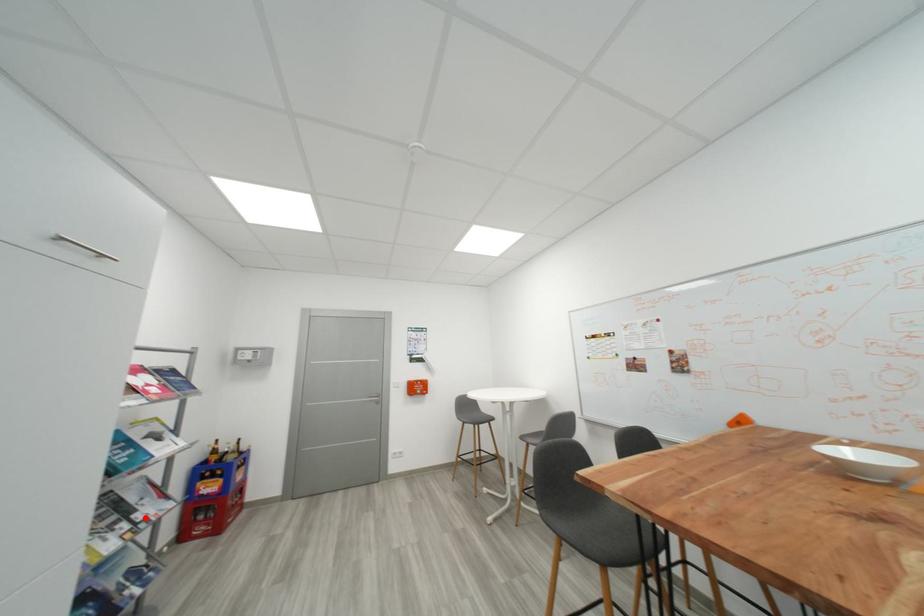
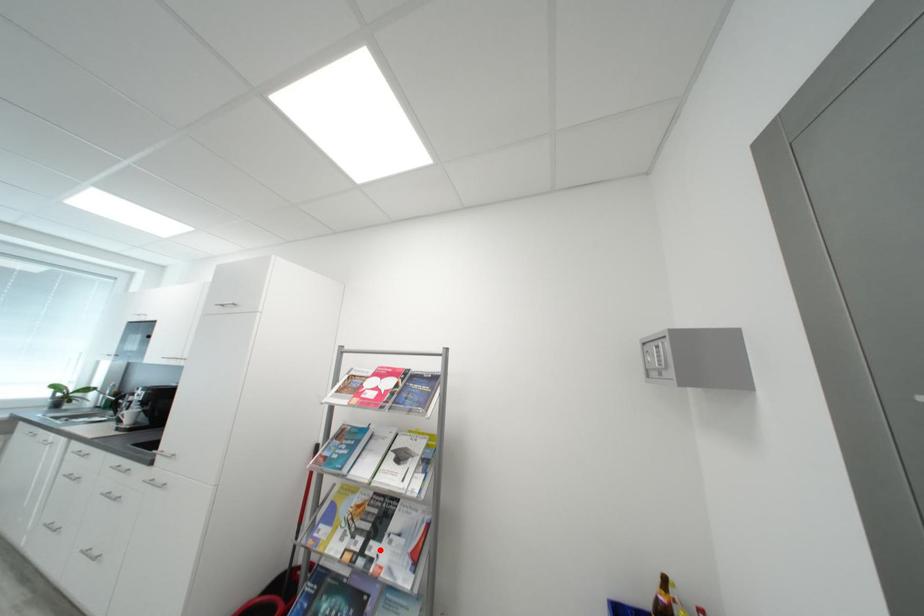
Looking at this image, I am providing you with two images of the same scene from different viewpoints. A red point is marked on the first image and another point is marked on the second image. Is the marked point in image1 the same physical position as the marked point in image2?

Yes